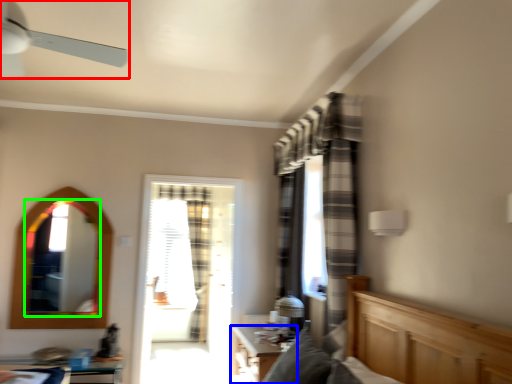
Question: Which object is the farthest from ceiling fan (highlighted by a red box)? Choose among these: table (highlighted by a blue box) or mirror (highlighted by a green box).

Choices:
 (A) table
 (B) mirror

Answer: (A)